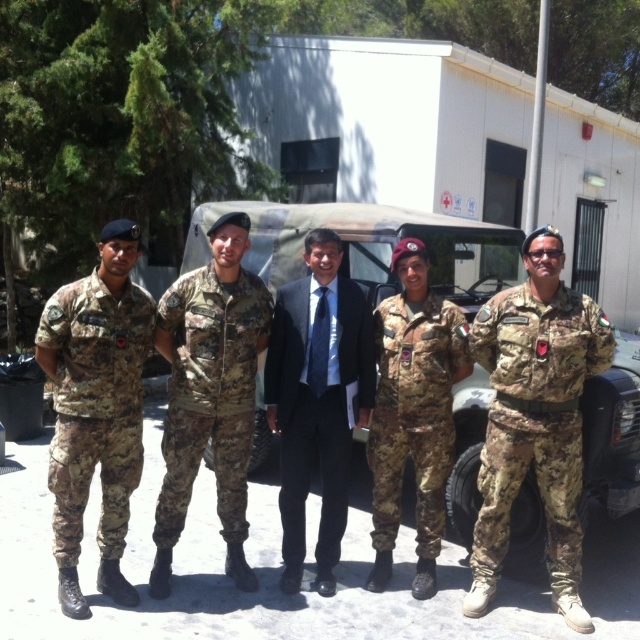
Between dark blue suit at center and camouflage fabric uniform at center, which one is positioned higher?

dark blue suit at center is above.

Can you confirm if dark blue suit at center is taller than camouflage fabric uniform at center?

Yes, dark blue suit at center is taller than camouflage fabric uniform at center.

At what (x,y) coordinates should I click in order to perform the action: click on dark blue suit at center. Please return your answer as a coordinate pair (x, y). The width and height of the screenshot is (640, 640). Looking at the image, I should click on (317, 400).

Where is `dark blue suit at center`? dark blue suit at center is located at coordinates (317, 400).

Can you confirm if camouflage fabric uniform at right is wider than camouflage fabric uniform at center?

Correct, the width of camouflage fabric uniform at right exceeds that of camouflage fabric uniform at center.

Who is positioned more to the right, camouflage fabric uniform at right or camouflage fabric uniform at center?

camouflage fabric uniform at right is more to the right.

Locate an element on the screen. This screenshot has width=640, height=640. camouflage fabric uniform at right is located at coordinates (536, 419).

Consider the image. Between camouflage fabric uniform at left and camouflage fabric uniform at center, which one appears on the left side from the viewer's perspective?

camouflage fabric uniform at left

The image size is (640, 640). What are the coordinates of `camouflage fabric uniform at left` in the screenshot? It's located at (96, 406).